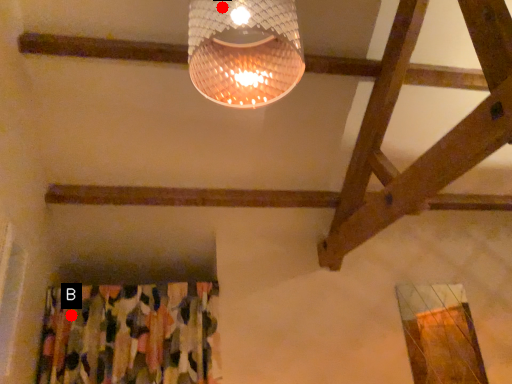
Question: Two points are circled on the image, labeled by A and B beside each circle. Which point is closer to the camera?

Choices:
 (A) A is closer
 (B) B is closer

Answer: (A)